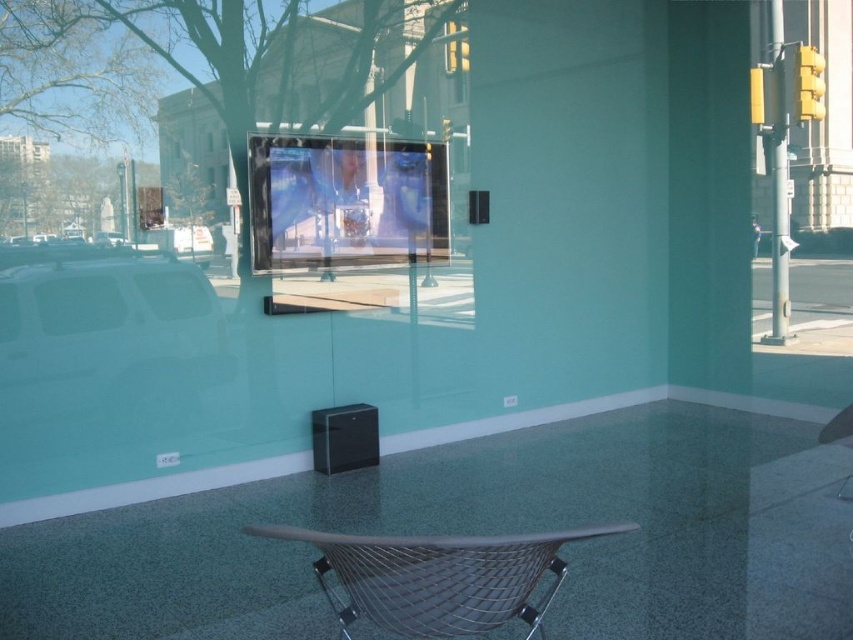
Question: Does transparent glass window at center have a larger size compared to metallic wire folding chair at center?

Choices:
 (A) no
 (B) yes

Answer: (B)

Question: Which object appears closest to the camera in this image?

Choices:
 (A) metallic wire folding chair at center
 (B) transparent glass window at center

Answer: (A)

Question: Is transparent glass window at center bigger than metallic wire folding chair at center?

Choices:
 (A) no
 (B) yes

Answer: (B)

Question: Is transparent glass window at center positioned in front of metallic wire folding chair at center?

Choices:
 (A) no
 (B) yes

Answer: (A)